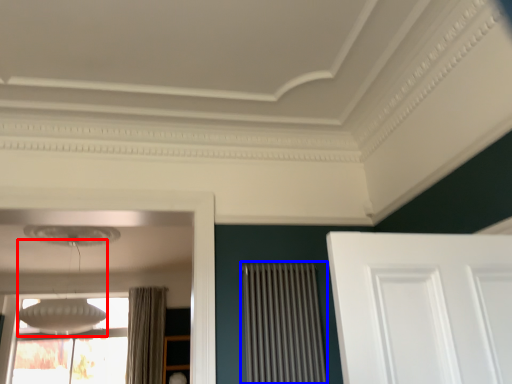
Question: Which object is closer to the camera taking this photo, lamp (highlighted by a red box) or radiator (highlighted by a blue box)?

Choices:
 (A) lamp
 (B) radiator

Answer: (B)